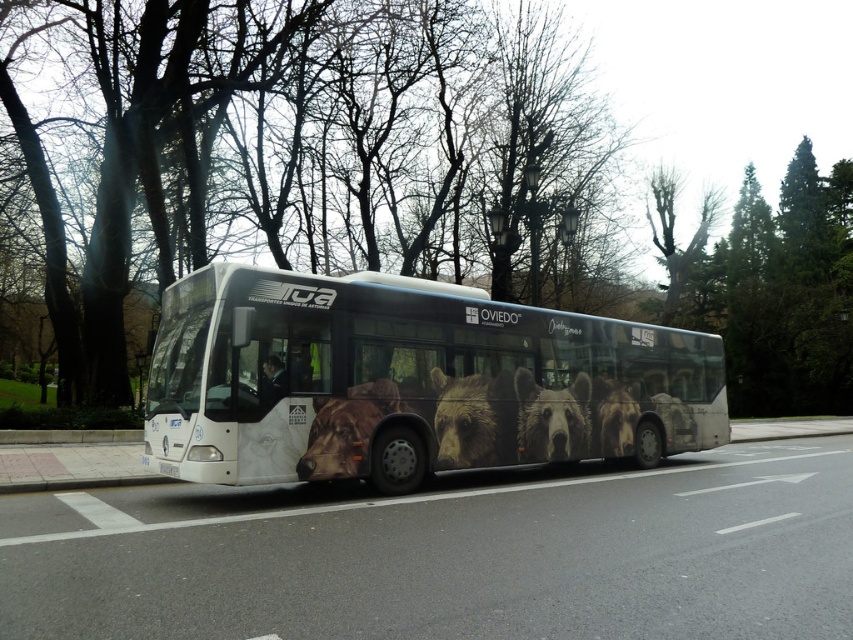
Who is positioned more to the left, green leafy tree at center or white plastic license plate at lower center?

Positioned to the left is white plastic license plate at lower center.

Is point (199, 141) less distant than point (160, 470)?

No.

You are a GUI agent. You are given a task and a screenshot of the screen. Output one action in this format:
    pyautogui.click(x=<x>, y=<y>)
    Task: Click on the green leafy tree at center
    
    Given the screenshot: What is the action you would take?
    pyautogui.click(x=379, y=180)

Who is higher up, green leafy tree at center or white metallic bus at center?

Positioned higher is green leafy tree at center.

Who is taller, green leafy tree at center or white metallic bus at center?

green leafy tree at center is taller.

The image size is (853, 640). I want to click on green leafy tree at center, so click(x=379, y=180).

The height and width of the screenshot is (640, 853). In order to click on green leafy tree at center in this screenshot , I will do `click(379, 180)`.

Which is more to the left, white metallic bus at center or white plastic license plate at lower center?

white plastic license plate at lower center

Can you confirm if white metallic bus at center is positioned above white plastic license plate at lower center?

Indeed, white metallic bus at center is positioned over white plastic license plate at lower center.

In order to click on white metallic bus at center in this screenshot , I will do `click(409, 381)`.

In order to click on white metallic bus at center in this screenshot , I will do `click(409, 381)`.